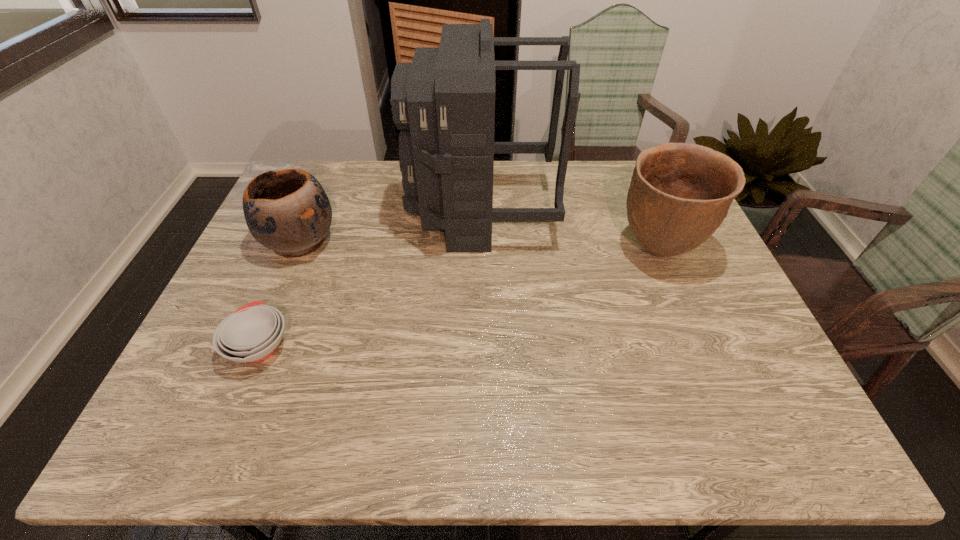
Find the location of `free spot between the left pottery and the shortest object`. free spot between the left pottery and the shortest object is located at coordinates (280, 293).

At what (x,y) coordinates should I click in order to perform the action: click on unoccupied area between the left pottery and the soup bowl. Please return your answer as a coordinate pair (x, y). The width and height of the screenshot is (960, 540). Looking at the image, I should click on (280, 293).

I want to click on free point between the shortest object and the rightmost object, so click(459, 298).

The height and width of the screenshot is (540, 960). Find the location of `free space between the right pottery and the shortest object`. free space between the right pottery and the shortest object is located at coordinates (459, 298).

Find the location of `the closest object relative to the right pottery`. the closest object relative to the right pottery is located at coordinates (444, 101).

What are the coordinates of `object that is the third nearest to the tallest object` in the screenshot? It's located at (252, 333).

Locate an element on the screen. Image resolution: width=960 pixels, height=540 pixels. vacant position in the image that satisfies the following two spatial constraints: 1. on the front side of the shorter pottery; 2. on the right side of the rightmost object is located at coordinates (297, 250).

Where is `free space that satisfies the following two spatial constraints: 1. on the front compartment of the tallest object; 2. on the back side of the third shortest object`? This screenshot has height=540, width=960. free space that satisfies the following two spatial constraints: 1. on the front compartment of the tallest object; 2. on the back side of the third shortest object is located at coordinates (481, 250).

Locate an element on the screen. free region that satisfies the following two spatial constraints: 1. on the back side of the rightmost object; 2. on the right side of the nearest object is located at coordinates (300, 250).